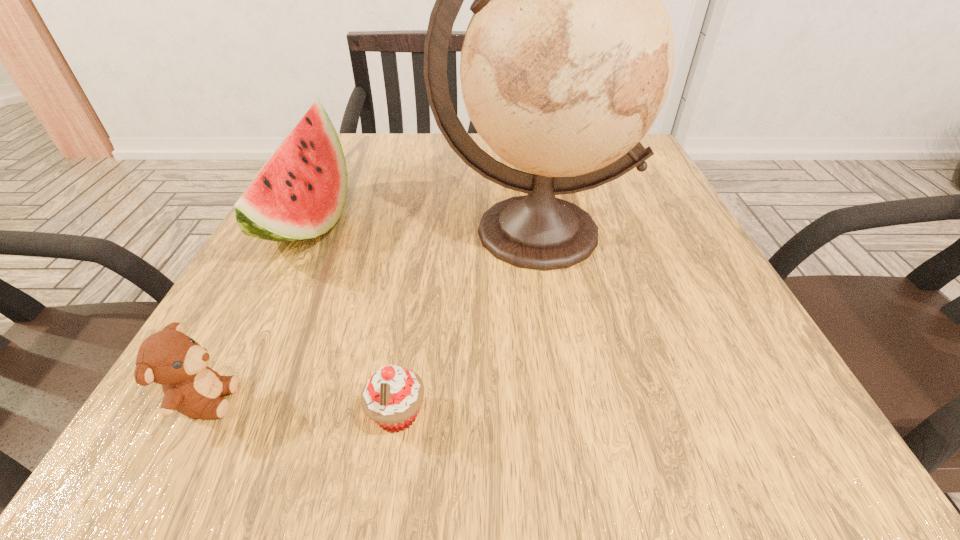
Where is `free point between the shortest object and the teddy bear`? free point between the shortest object and the teddy bear is located at coordinates (301, 407).

Find the location of `free space between the teddy bear and the cupcake`. free space between the teddy bear and the cupcake is located at coordinates (301, 407).

This screenshot has width=960, height=540. I want to click on vacant area between the teddy bear and the tallest object, so click(x=370, y=316).

I want to click on vacant area that lies between the teddy bear and the shortest object, so click(301, 407).

At what (x,y) coordinates should I click in order to perform the action: click on vacant space that's between the shortest object and the tallest object. Please return your answer as a coordinate pair (x, y). Looking at the image, I should click on (466, 323).

At what (x,y) coordinates should I click in order to perform the action: click on free spot between the shortest object and the teddy bear. Please return your answer as a coordinate pair (x, y). This screenshot has height=540, width=960. Looking at the image, I should click on (x=301, y=407).

Identify which object is located as the third nearest to the second tallest object. Please provide its 2D coordinates. Your answer should be formatted as a tuple, i.e. [(x, y)], where the tuple contains the x and y coordinates of a point satisfying the conditions above.

[(392, 396)]

Where is `object that is the closest to the watermelon`? The height and width of the screenshot is (540, 960). object that is the closest to the watermelon is located at coordinates (170, 358).

Locate an element on the screen. This screenshot has width=960, height=540. free region that satisfies the following two spatial constraints: 1. on the face of the cupcake; 2. on the left side of the teddy bear is located at coordinates (199, 415).

The image size is (960, 540). Identify the location of vacant position in the image that satisfies the following two spatial constraints: 1. on the front-facing side of the globe; 2. on the face of the teddy bear. (560, 400).